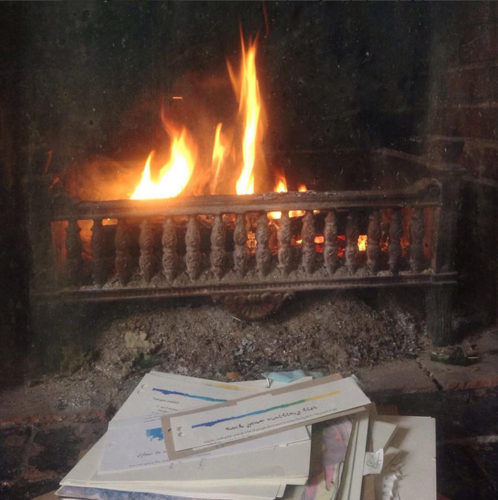
The image size is (498, 500). What are the coordinates of `brick fireplace wall` in the screenshot? It's located at [490, 118], [22, 142].